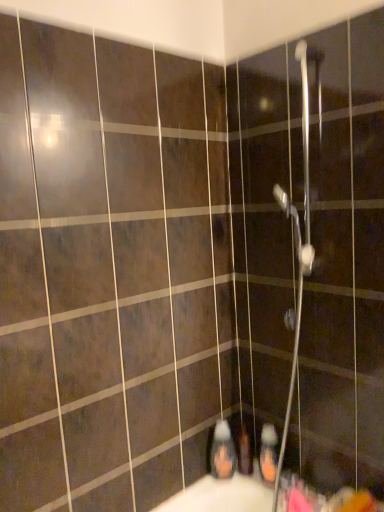
Question: Is translucent plastic soap dispenser at lower center, placed as the third toiletry when sorted from right to left, bigger or smaller than matte plastic toothbrush at lower center, which is the second toiletry in right-to-left order?

Choices:
 (A) big
 (B) small

Answer: (A)

Question: In terms of width, does translucent plastic soap dispenser at lower center, placed as the third toiletry when sorted from right to left, look wider or thinner when compared to matte plastic toothbrush at lower center, placed as the 2th toiletry when sorted from left to right?

Choices:
 (A) thin
 (B) wide

Answer: (A)

Question: Based on their relative distances, which object is nearer to the orange matte bottle at lower center, which is the 3th toiletry in left-to-right order?

Choices:
 (A) translucent plastic soap dispenser at lower center, which is the 1th toiletry in left-to-right order
 (B) matte plastic toothbrush at lower center, placed as the 2th toiletry when sorted from left to right
 (C) metallic silver shower head at upper center

Answer: (B)

Question: Which object is the farthest from the matte plastic toothbrush at lower center, which is the second toiletry in right-to-left order?

Choices:
 (A) metallic silver shower head at upper center
 (B) orange matte bottle at lower center, the 1th toiletry viewed from the right
 (C) translucent plastic soap dispenser at lower center, which is the 1th toiletry in left-to-right order

Answer: (A)